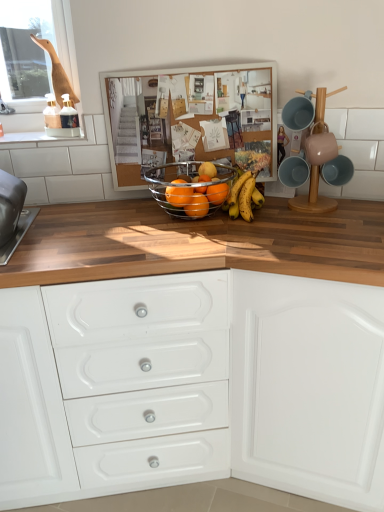
The width and height of the screenshot is (384, 512). I want to click on free space to the left of glossy orange at center, which is the first orange from right to left, so click(151, 221).